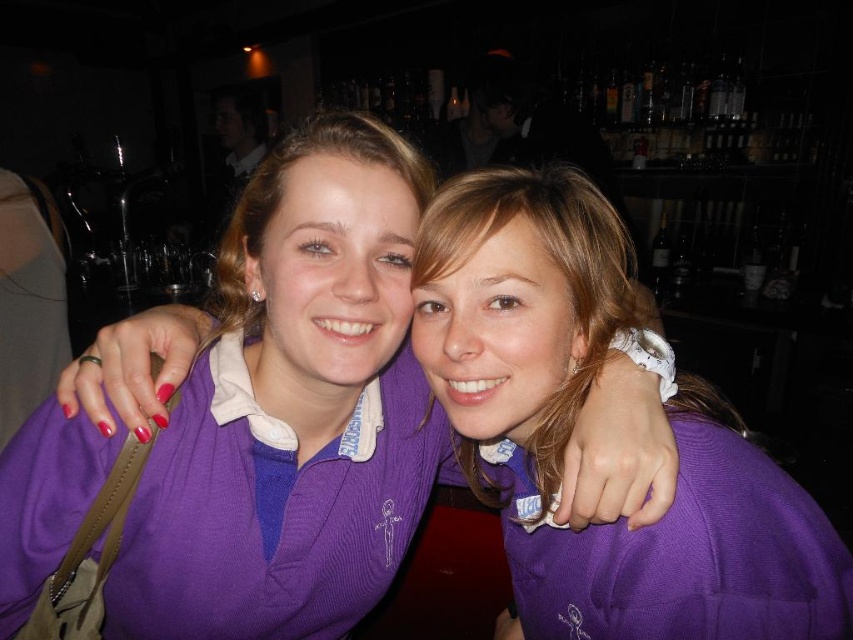
Question: Does purple jersey at center have a larger size compared to purple ribbed sweater at center?

Choices:
 (A) no
 (B) yes

Answer: (B)

Question: Is purple jersey at center thinner than purple ribbed sweater at center?

Choices:
 (A) no
 (B) yes

Answer: (A)

Question: Which point appears closest to the camera in this image?

Choices:
 (A) (164, 468)
 (B) (744, 582)

Answer: (B)

Question: Is purple jersey at center closer to the viewer compared to purple ribbed sweater at center?

Choices:
 (A) yes
 (B) no

Answer: (B)